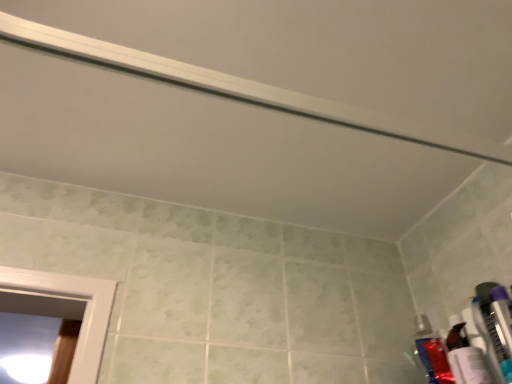
Question: Relative to translucent plastic toothpaste tube at lower right, which is counted as the 2th toiletry, starting from the back, is translucent plastic toothbrush at lower right, which is counted as the third toiletry, starting from the back, in front or behind?

Choices:
 (A) front
 (B) behind

Answer: (A)

Question: Based on their sizes in the image, would you say translucent plastic toothbrush at lower right, which appears as the 2th toiletry when viewed from the front, is bigger or smaller than translucent plastic toothpaste tube at lower right, which is counted as the 2th toiletry, starting from the back?

Choices:
 (A) big
 (B) small

Answer: (B)

Question: Estimate the real-world distances between objects in this image. Which object is farther from the translucent plastic toothbrush at lower right, which is counted as the third toiletry, starting from the back?

Choices:
 (A) translucent plastic toothpaste tube at lower right, which is counted as the 2th toiletry, starting from the back
 (B) matte plastic toothpaste tube at right, which is counted as the fourth toiletry, starting from the front
 (C) purple plastic toothbrush at right, arranged as the fourth toiletry when viewed from the back

Answer: (B)

Question: Estimate the real-world distances between objects in this image. Which object is closer to the translucent plastic toothpaste tube at lower right, which is counted as the 2th toiletry, starting from the back?

Choices:
 (A) matte plastic toothpaste tube at right, the 1th toiletry viewed from the back
 (B) purple plastic toothbrush at right, placed as the 1th toiletry when sorted from front to back
 (C) translucent plastic toothbrush at lower right, which appears as the 2th toiletry when viewed from the front

Answer: (C)